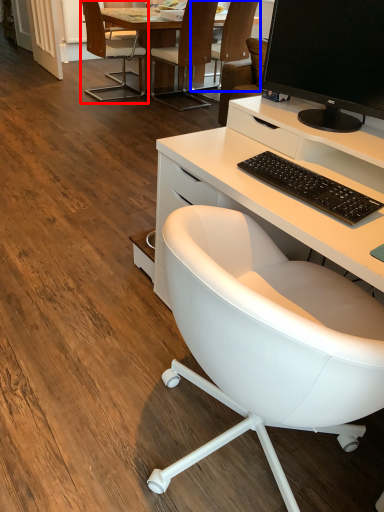
Question: Which object appears closest to the camera in this image, chair (highlighted by a red box) or chair (highlighted by a blue box)?

Choices:
 (A) chair
 (B) chair

Answer: (A)